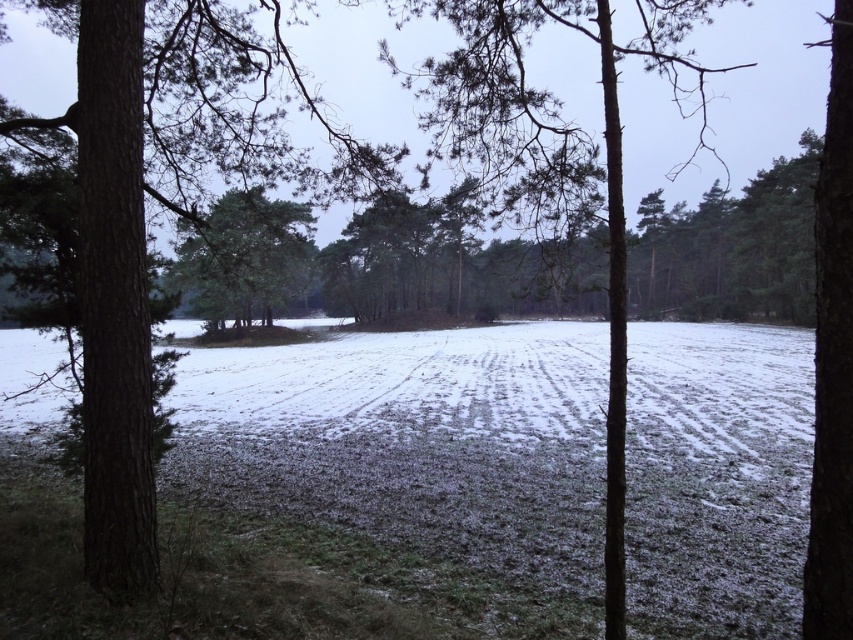
Question: Can you confirm if brown rough bark tree at left is wider than green matte tree at center?

Choices:
 (A) yes
 (B) no

Answer: (B)

Question: Can you confirm if brown rough bark tree at left is thinner than green matte tree at center?

Choices:
 (A) yes
 (B) no

Answer: (A)

Question: Estimate the real-world distances between objects in this image. Which object is farther from the brown rough bark tree at left?

Choices:
 (A) green matte tree at center
 (B) smooth bark tree at center

Answer: (B)

Question: Is brown rough bark tree at left to the left of green matte tree at center from the viewer's perspective?

Choices:
 (A) yes
 (B) no

Answer: (B)

Question: Which point appears farthest from the camera in this image?

Choices:
 (A) (566, 125)
 (B) (184, 262)
 (C) (173, 115)

Answer: (B)

Question: Which point is closer to the camera taking this photo?

Choices:
 (A) (491, 145)
 (B) (309, 273)

Answer: (A)